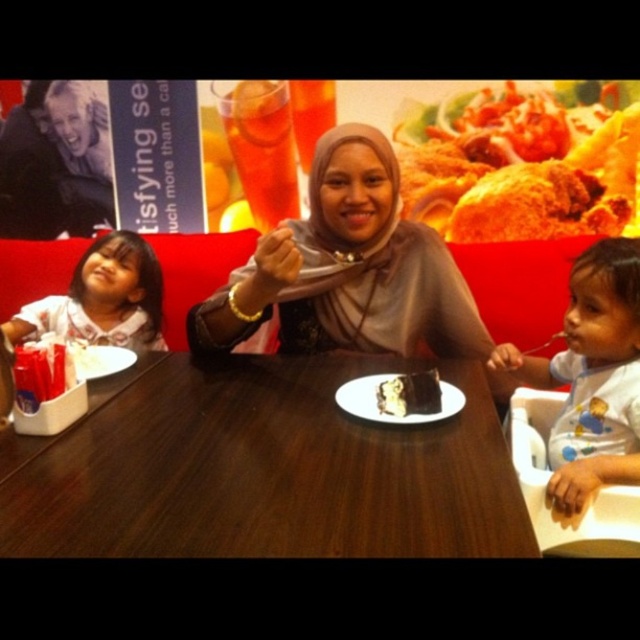
You are a photographer setting up for a family photo. You need to ensure that the matte brown hijab at center and the chocolate cake at center are both visible in the frame. Based on their sizes, which object might require more space in the composition?

The matte brown hijab at center is larger in size than the chocolate cake at center, so it would require more space in the composition to ensure it is fully visible.

You are a waiter in a restaurant and need to place a dessert plate that is 12 inches wide between the smooth white shirt at right and the chocolate cake at center. Can you fit it there?

The distance between the smooth white shirt at right and the chocolate cake at center is 15.19 inches. Since the dessert plate is 12 inches wide, there is enough space to fit it between them.